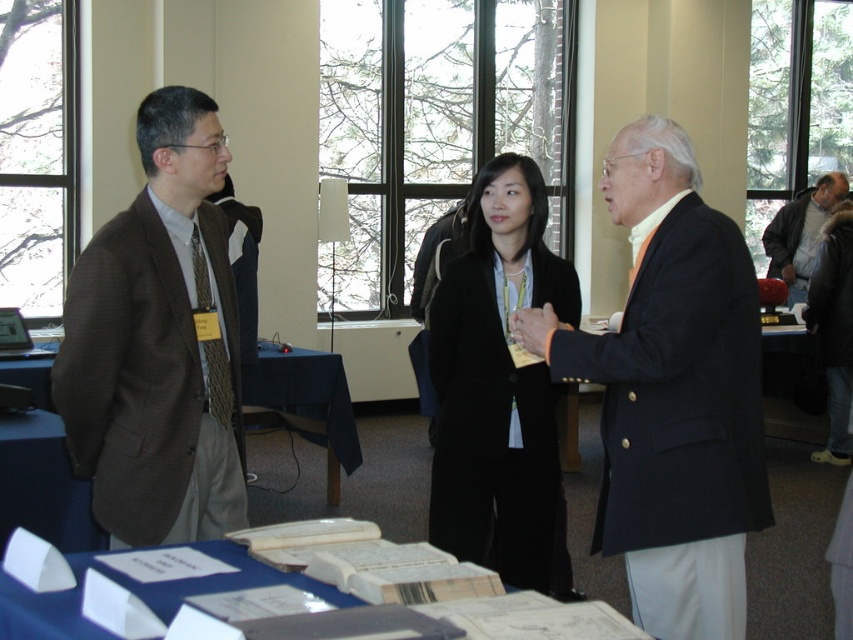
You are organizing a photoshoot and need to arrange the brown textured blazer at left and the black matte blazer at center based on their positions in the image. Which blazer should be placed higher up in the arrangement if you want to maintain the same spatial relationship as shown?

The brown textured blazer at left should be placed higher up because it is positioned over the black matte blazer at center in the image.

You are organizing a charity event and need to arrange two blazers on a mannequin stand. The brown textured blazer at left is shorter than the black matte blazer at center. Which blazer should you place on the taller mannequin to ensure they are proportional?

The black matte blazer at center should be placed on the taller mannequin since it is longer than the brown textured blazer at left, ensuring proportionality.